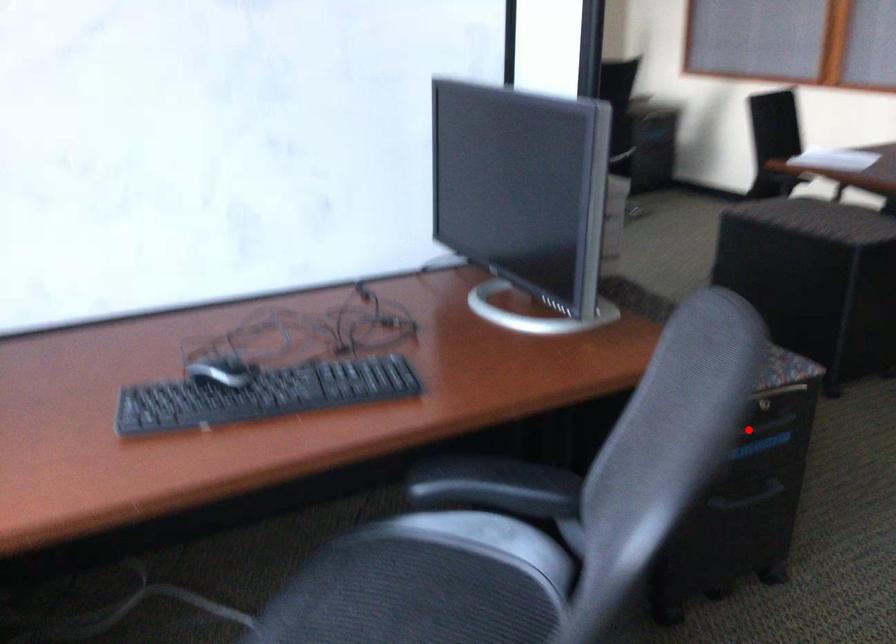
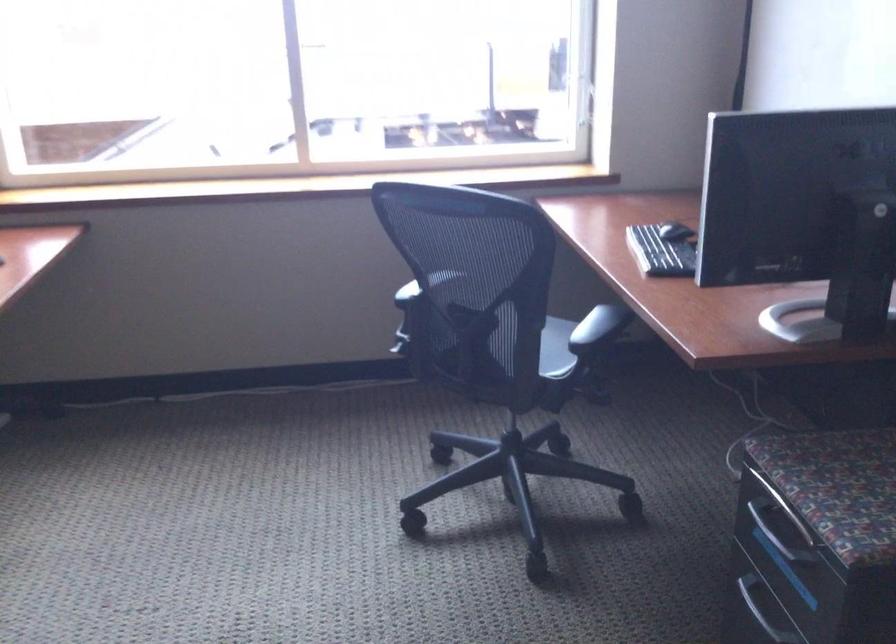
Question: I am providing you with two images of the same scene from different viewpoints. Given a red point in image1, look at the same physical point in image2. Is it:

Choices:
 (A) Closer to the viewpoint
 (B) Farther from the viewpoint

Answer: (A)